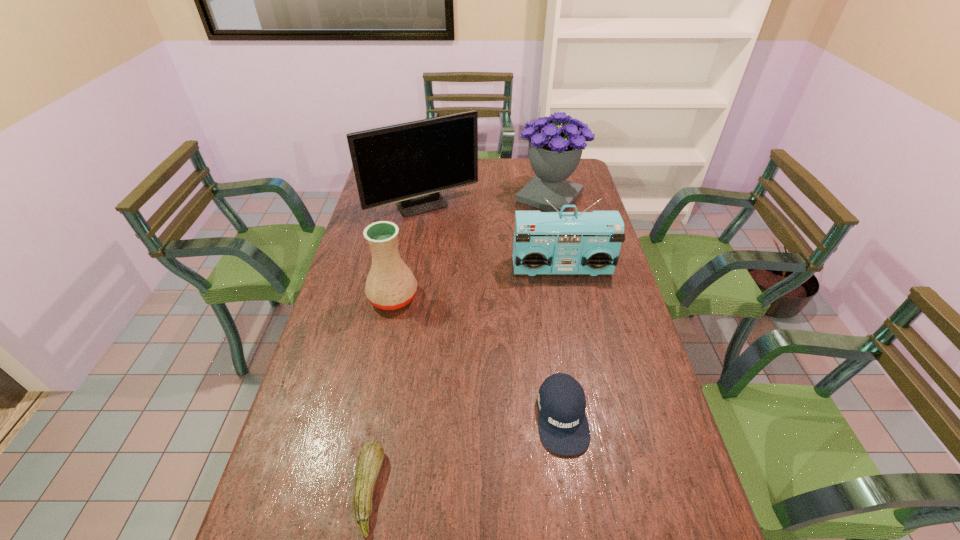
Find the location of `computer monitor`. computer monitor is located at coordinates (408, 164).

In order to click on bouquet in this screenshot , I will do `click(554, 152)`.

Locate an element on the screen. radio receiver is located at coordinates (544, 242).

What are the coordinates of `pottery` in the screenshot? It's located at (390, 285).

Locate an element on the screen. baseball cap is located at coordinates (563, 426).

Identify the location of zucchini. 370,459.

Image resolution: width=960 pixels, height=540 pixels. Find the location of `vacant space situated 0.130m on the front-facing side of the computer monitor`. vacant space situated 0.130m on the front-facing side of the computer monitor is located at coordinates (417, 244).

I want to click on blank space located on the back of the bouquet, so click(544, 170).

This screenshot has width=960, height=540. Find the location of `vacant area situated on the front-facing side of the radio receiver`. vacant area situated on the front-facing side of the radio receiver is located at coordinates coord(579,353).

Locate an element on the screen. This screenshot has width=960, height=540. blank area located on the right of the pottery is located at coordinates (510, 298).